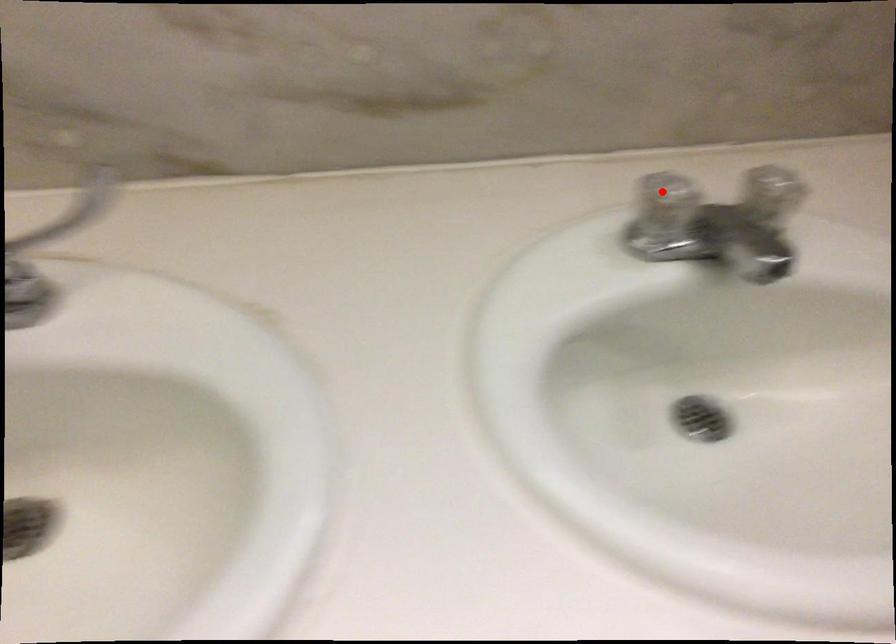
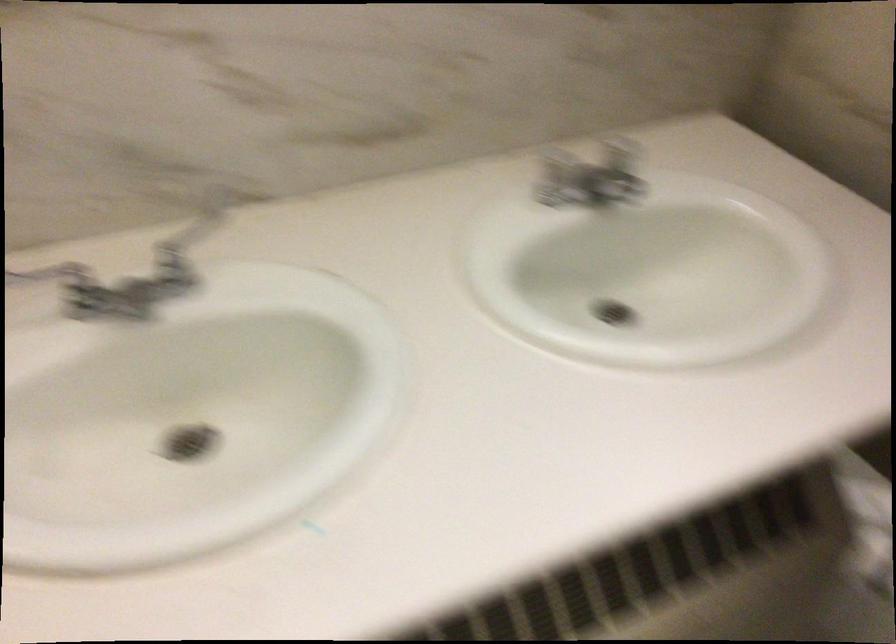
Where in the second image is the point corresponding to the highlighted location from the first image?

(554, 158)